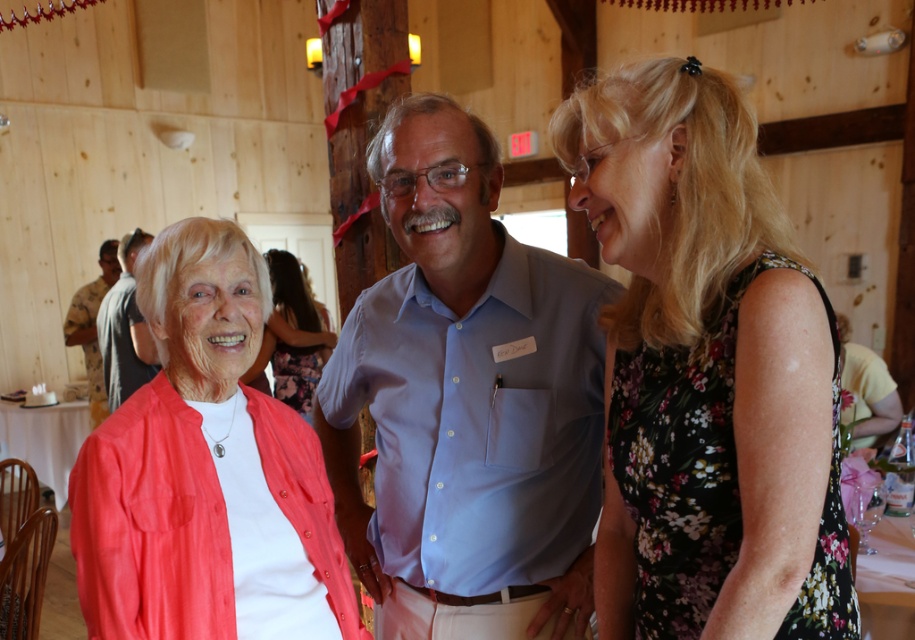
Consider the image. You are standing in the rustic wooden barn and see the matte coral cardigan at center. Where exactly is it located in the barn?

The matte coral cardigan at center is located at point (293, 336) in the barn.

You are organizing a photo shoot and need to ensure that the floral dress at center and the matte coral blouse at center are visible in the frame. Given their sizes, which one might require more space to avoid being cropped?

The floral dress at center has a larger size compared to the matte coral blouse at center, so it would require more space to avoid being cropped.